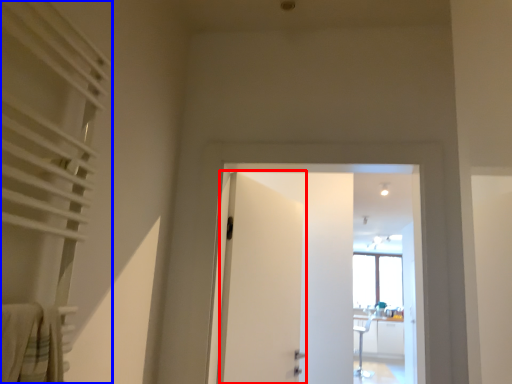
Question: Which object is further to the camera taking this photo, door (highlighted by a red box) or curtain (highlighted by a blue box)?

Choices:
 (A) door
 (B) curtain

Answer: (A)